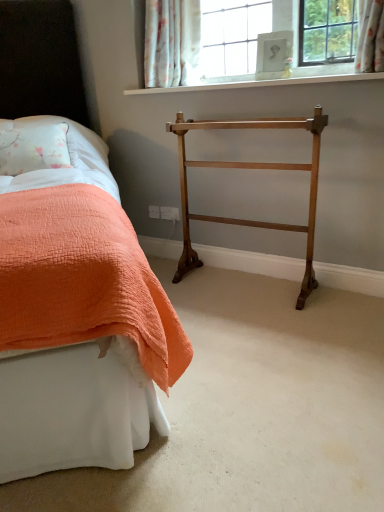
Question: Would you consider orange quilted bed at left to be distant from white quilted fabric at left?

Choices:
 (A) yes
 (B) no

Answer: (B)

Question: From the image's perspective, is orange quilted bed at left under white quilted fabric at left?

Choices:
 (A) yes
 (B) no

Answer: (A)

Question: Considering the relative sizes of orange quilted bed at left and white quilted fabric at left in the image provided, is orange quilted bed at left thinner than white quilted fabric at left?

Choices:
 (A) no
 (B) yes

Answer: (A)

Question: Is white quilted fabric at left surrounded by orange quilted bed at left?

Choices:
 (A) yes
 (B) no

Answer: (A)

Question: Is orange quilted bed at left to the right of white quilted fabric at left from the viewer's perspective?

Choices:
 (A) yes
 (B) no

Answer: (A)

Question: From the image's perspective, is floral fabric curtain at upper center above or below polished brass towel rack at center?

Choices:
 (A) below
 (B) above

Answer: (B)

Question: Is floral fabric curtain at upper center taller or shorter than polished brass towel rack at center?

Choices:
 (A) short
 (B) tall

Answer: (A)

Question: Considering the positions of point (150, 48) and point (182, 253), is point (150, 48) closer or farther from the camera than point (182, 253)?

Choices:
 (A) closer
 (B) farther

Answer: (A)

Question: In the image, is floral fabric curtain at upper center positioned in front of or behind polished brass towel rack at center?

Choices:
 (A) behind
 (B) front

Answer: (A)

Question: Is floral fabric curtain at upper center bigger or smaller than white painted wood at upper center?

Choices:
 (A) big
 (B) small

Answer: (A)

Question: Is point (193, 11) closer or farther from the camera than point (134, 89)?

Choices:
 (A) closer
 (B) farther

Answer: (A)

Question: Considering the positions of floral fabric curtain at upper center and white painted wood at upper center in the image, is floral fabric curtain at upper center taller or shorter than white painted wood at upper center?

Choices:
 (A) short
 (B) tall

Answer: (B)

Question: Choose the correct answer: Is floral fabric curtain at upper center inside white painted wood at upper center or outside it?

Choices:
 (A) inside
 (B) outside

Answer: (B)

Question: In terms of width, does white quilted fabric at left look wider or thinner when compared to floral fabric curtain at upper center?

Choices:
 (A) thin
 (B) wide

Answer: (B)

Question: Would you say white quilted fabric at left is to the left or to the right of floral fabric curtain at upper center in the picture?

Choices:
 (A) left
 (B) right

Answer: (A)